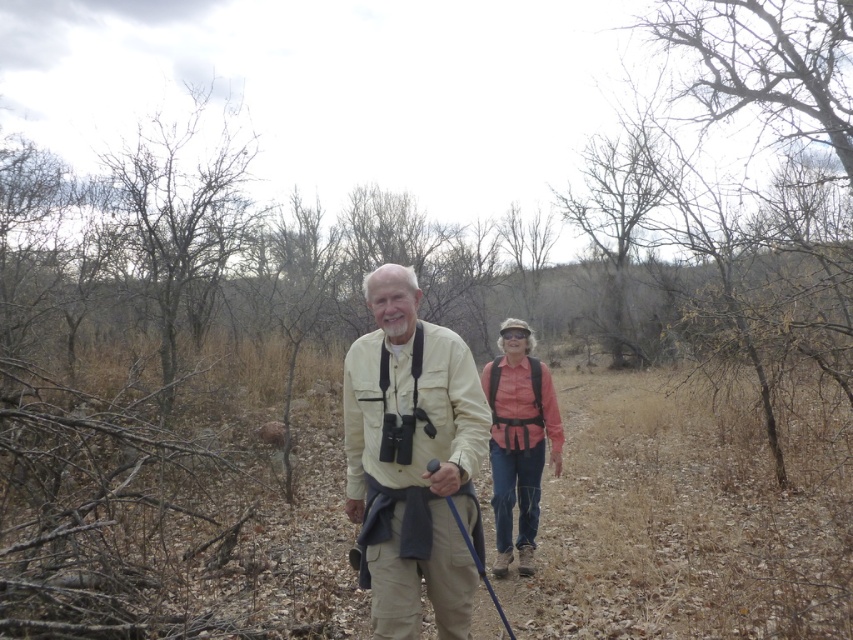
Does beige fabric shirt at center appear under pink fabric shirt at center?

Incorrect, beige fabric shirt at center is not positioned below pink fabric shirt at center.

Who is more forward, [419,420] or [514,477]?

Point [419,420] is more forward.

I want to click on beige fabric shirt at center, so click(x=412, y=460).